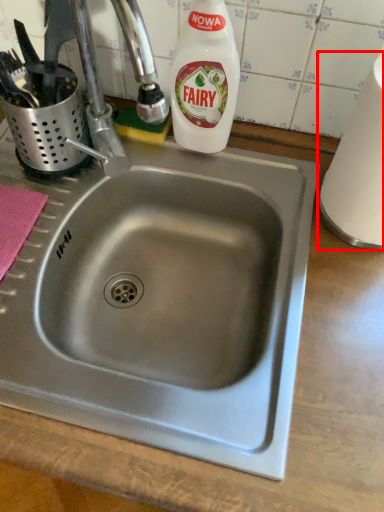
Question: From the image, what is the correct spatial relationship of paper towel (annotated by the red box) in relation to cleaning product?

Choices:
 (A) right
 (B) left

Answer: (A)